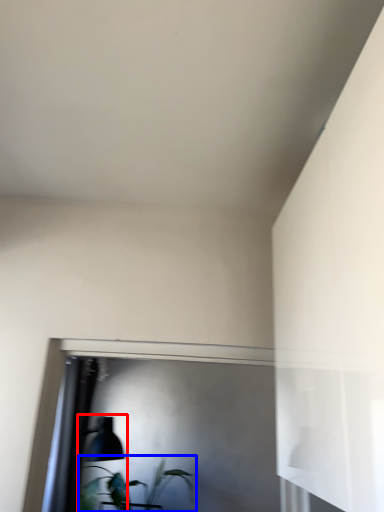
Question: Which of the following is the closest to the observer, table lamp (highlighted by a red box) or houseplant (highlighted by a blue box)?

Choices:
 (A) table lamp
 (B) houseplant

Answer: (A)